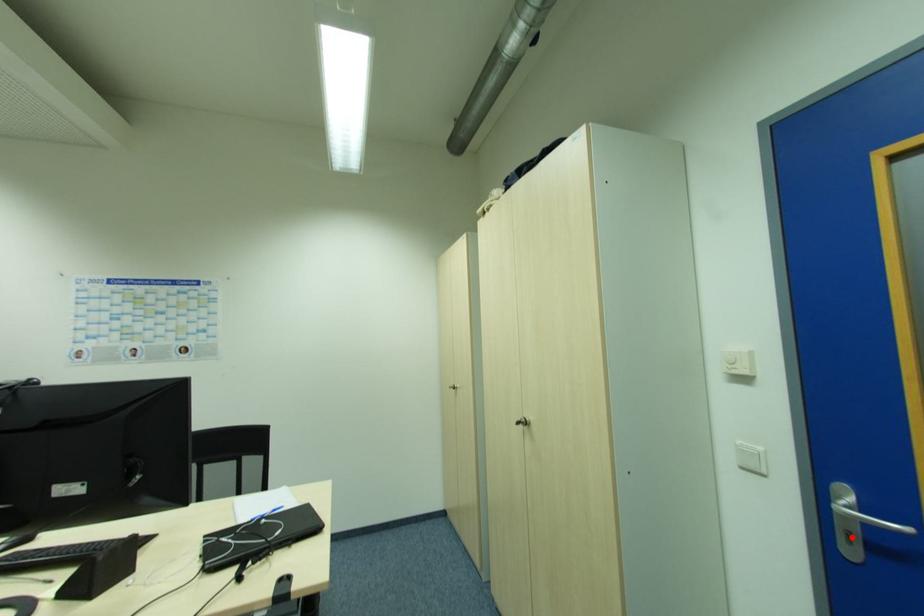
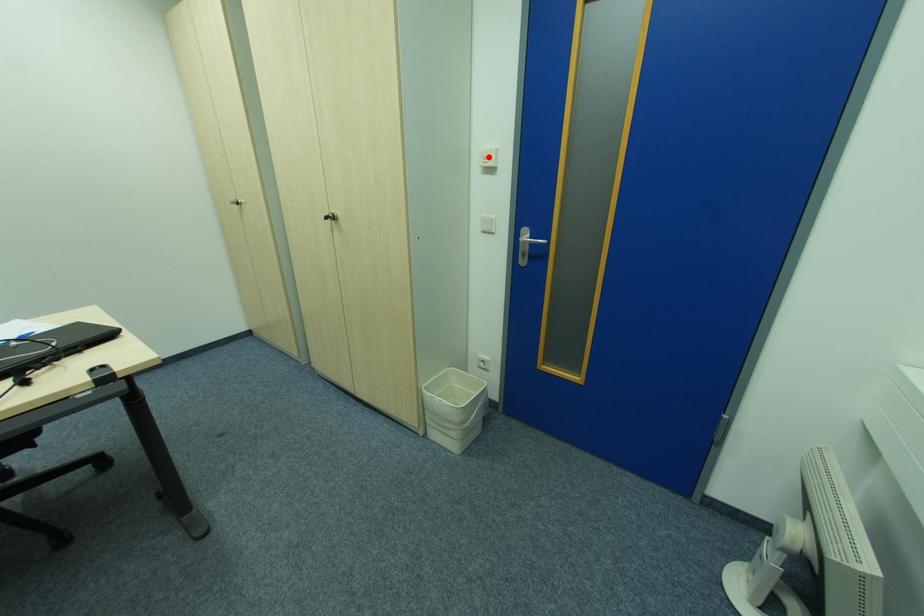
I am providing you with two images of the same scene from different viewpoints. A red point is marked on the first image and another point is marked on the second image. Is the red point in image1 aligned with the point shown in image2?

No